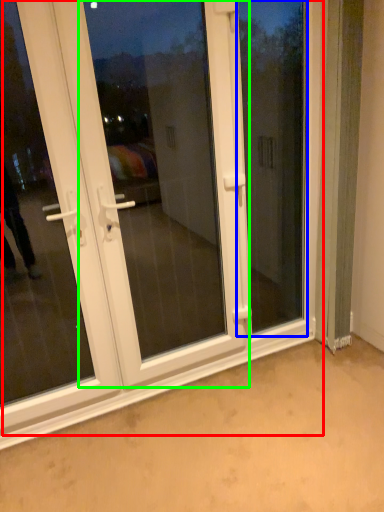
Question: Based on their relative distances, which object is farther from door (highlighted by a red box)? Choose from window screen (highlighted by a blue box) and screen door (highlighted by a green box).

Choices:
 (A) window screen
 (B) screen door

Answer: (B)